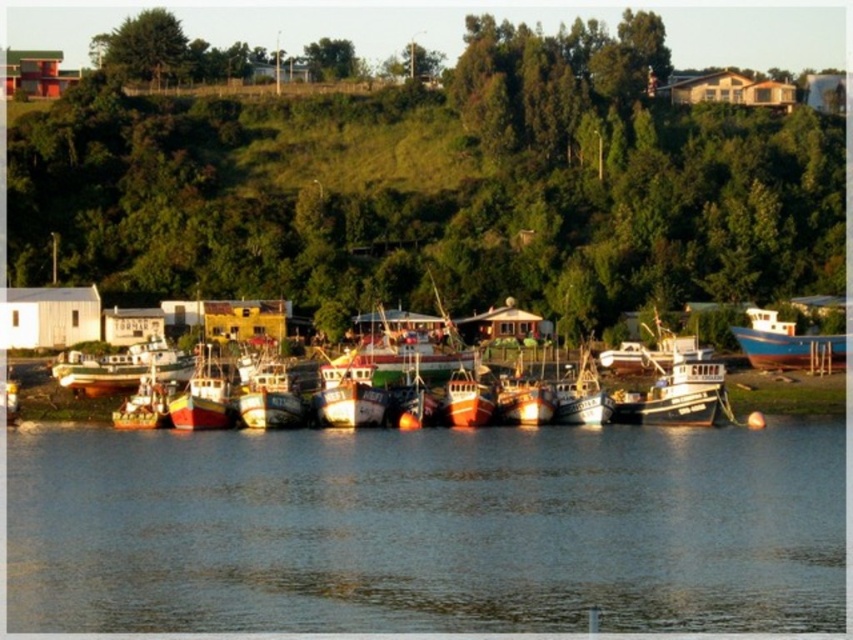
Between clear water at center and wooden fishing boat at center, which one has less height?

clear water at center

Who is taller, clear water at center or wooden fishing boat at center?

wooden fishing boat at center is taller.

Describe the element at coordinates (427, 529) in the screenshot. The width and height of the screenshot is (853, 640). I see `clear water at center` at that location.

This screenshot has width=853, height=640. What are the coordinates of `clear water at center` in the screenshot? It's located at (427, 529).

Between clear water at center and blue matte boat at right, which one is positioned higher?

blue matte boat at right is above.

Is point (659, 451) closer to viewer compared to point (781, 353)?

Yes, point (659, 451) is closer to viewer.

Between point (294, 461) and point (772, 340), which one is positioned in front?

Point (294, 461)

I want to click on clear water at center, so tap(427, 529).

Can you confirm if green grassy hillside at upper center is wider than wooden fishing boat at center?

Indeed, green grassy hillside at upper center has a greater width compared to wooden fishing boat at center.

Who is more distant from viewer, [79,253] or [57,372]?

The point [79,253] is more distant.

Between point (666, 177) and point (132, 352), which one is positioned behind?

The point (666, 177) is behind.

Locate an element on the screen. This screenshot has height=640, width=853. green grassy hillside at upper center is located at coordinates (419, 205).